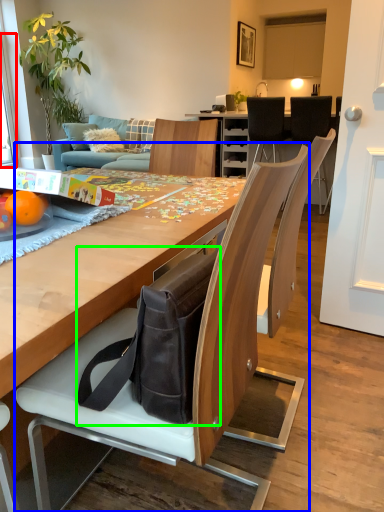
Question: Estimate the real-world distances between objects in this image. Which object is closer to window screen (highlighted by a red box), chair (highlighted by a blue box) or messenger bag (highlighted by a green box)?

Choices:
 (A) chair
 (B) messenger bag

Answer: (A)